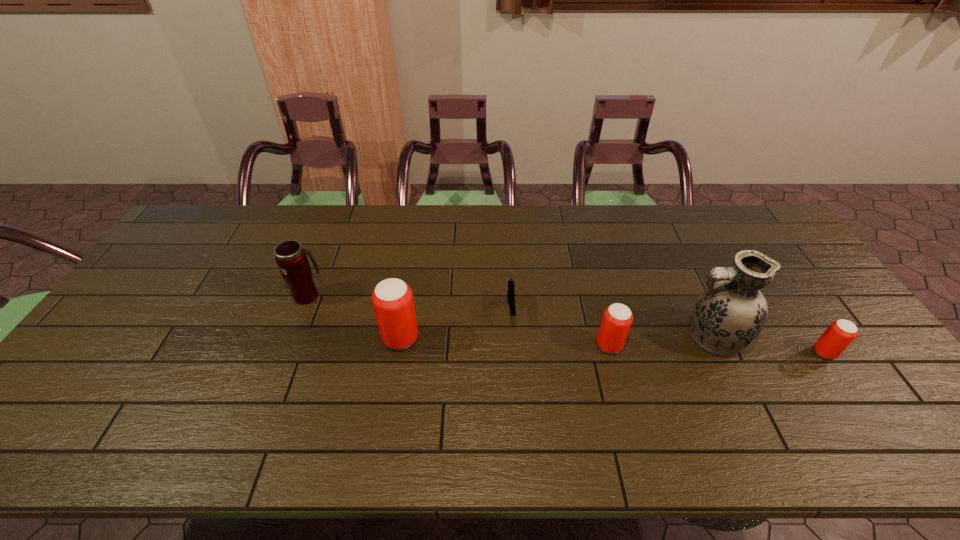
Please point out where to position a new beer can on the left to maintain spacing. Please provide its 2D coordinates. Your answer should be formatted as a tuple, i.e. [(x, y)], where the tuple contains the x and y coordinates of a point satisfying the conditions above.

[(198, 331)]